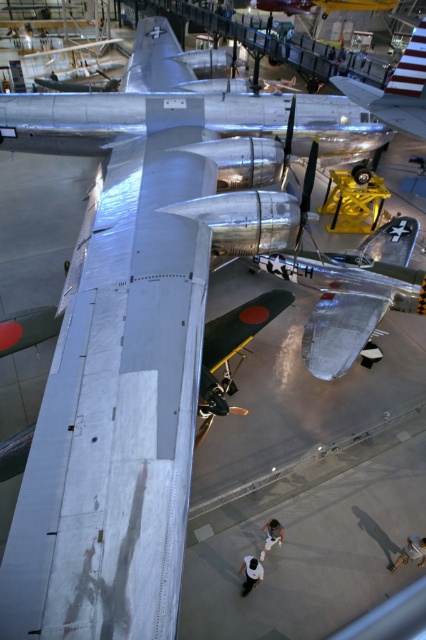
Does polished silver airplane at center have a larger size compared to white fabric bag at lower right?

Correct, polished silver airplane at center is larger in size than white fabric bag at lower right.

Is point (304, 262) positioned before point (425, 552)?

No, (304, 262) is behind (425, 552).

The image size is (426, 640). Find the location of `polished silver airplane at center`. polished silver airplane at center is located at coordinates (353, 292).

Who is shorter, silver metallic airplane at upper center or white matte shirt at center?

white matte shirt at center is shorter.

Between point (391, 100) and point (250, 589), which one is positioned behind?

The point (250, 589) is more distant.

I want to click on silver metallic airplane at upper center, so click(x=397, y=90).

Is white matte shirt at center bigger than white fabric shirt at center?

Actually, white matte shirt at center might be smaller than white fabric shirt at center.

Is point (245, 582) farther from camera compared to point (267, 529)?

No, (245, 582) is closer to viewer.

Image resolution: width=426 pixels, height=640 pixels. I want to click on white matte shirt at center, so click(x=250, y=573).